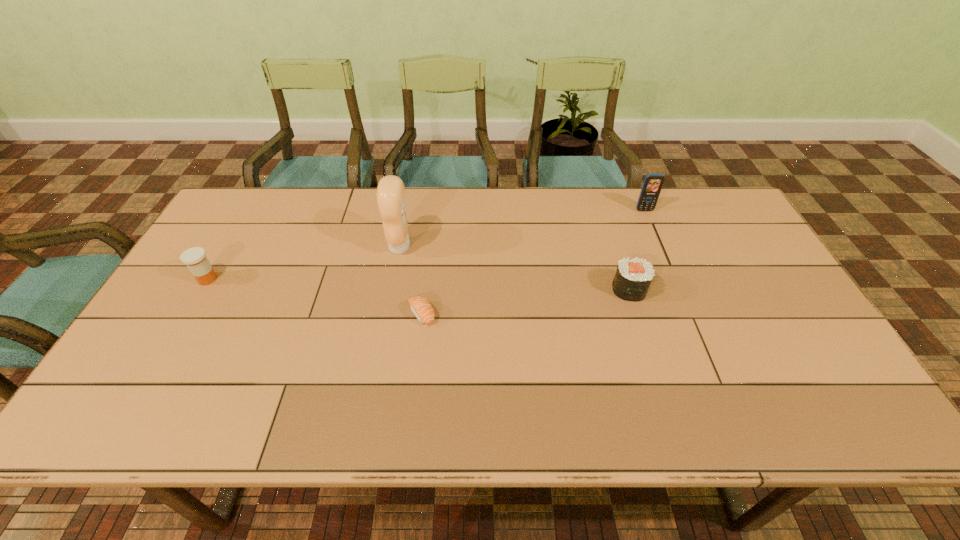
This screenshot has width=960, height=540. Identify the location of condiment. (390, 194).

You are a GUI agent. You are given a task and a screenshot of the screen. Output one action in this format:
    pyautogui.click(x=<x>, y=<y>)
    Task: Click on the fourth object from right to left
    
    Given the screenshot: What is the action you would take?
    pyautogui.click(x=390, y=194)

You are a GUI agent. You are given a task and a screenshot of the screen. Output one action in this format:
    pyautogui.click(x=<x>, y=<y>)
    Task: Click on the second tallest object
    This screenshot has width=960, height=540.
    Given the screenshot: What is the action you would take?
    pyautogui.click(x=652, y=185)

Locate an element on the screen. The height and width of the screenshot is (540, 960). the farthest object is located at coordinates (652, 185).

Where is `medicine`? medicine is located at coordinates (195, 258).

Where is `the taller sushi`? The image size is (960, 540). the taller sushi is located at coordinates (633, 277).

In order to click on the second object from right to left in this screenshot , I will do `click(633, 277)`.

Where is `the shorter sushi`? the shorter sushi is located at coordinates coord(420,306).

I want to click on the left sushi, so click(x=420, y=306).

Find the location of `free space located on the label of the tallest object`. free space located on the label of the tallest object is located at coordinates (428, 246).